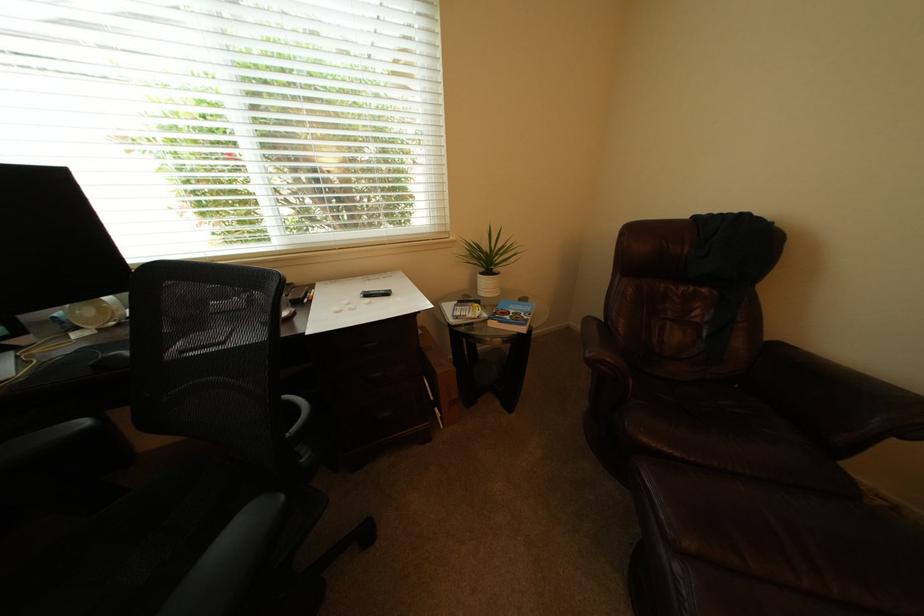
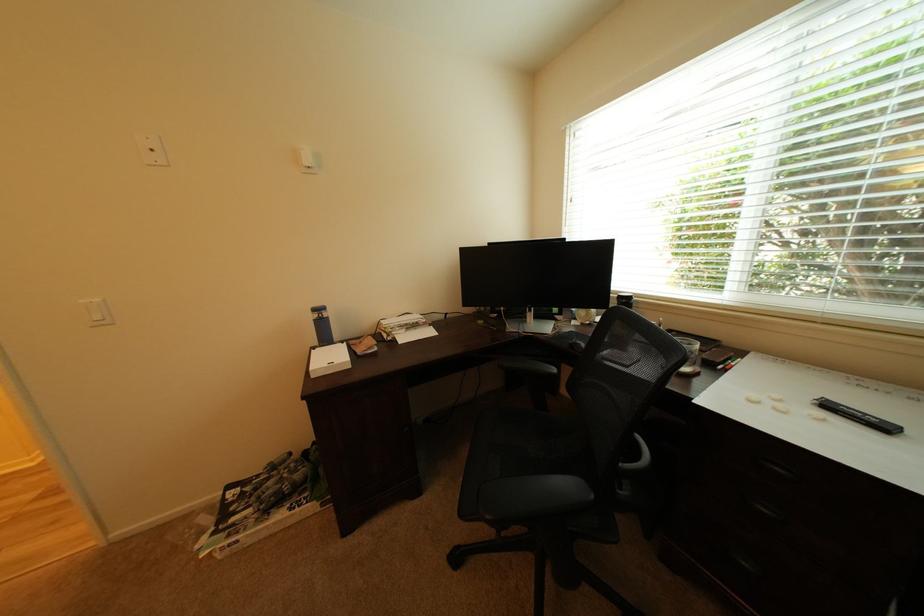
Find the pixel in the second image that matches point 300,432 in the first image.

(636, 466)